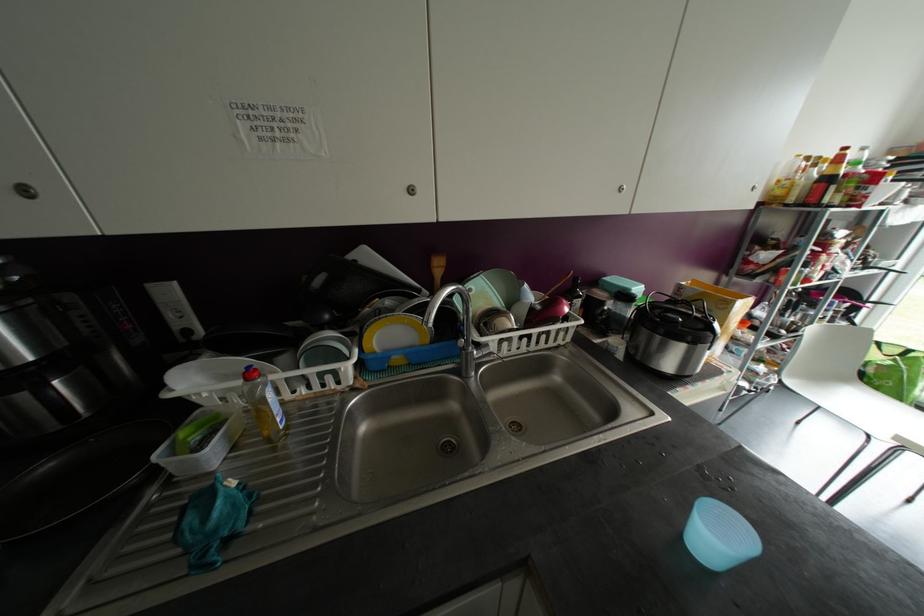
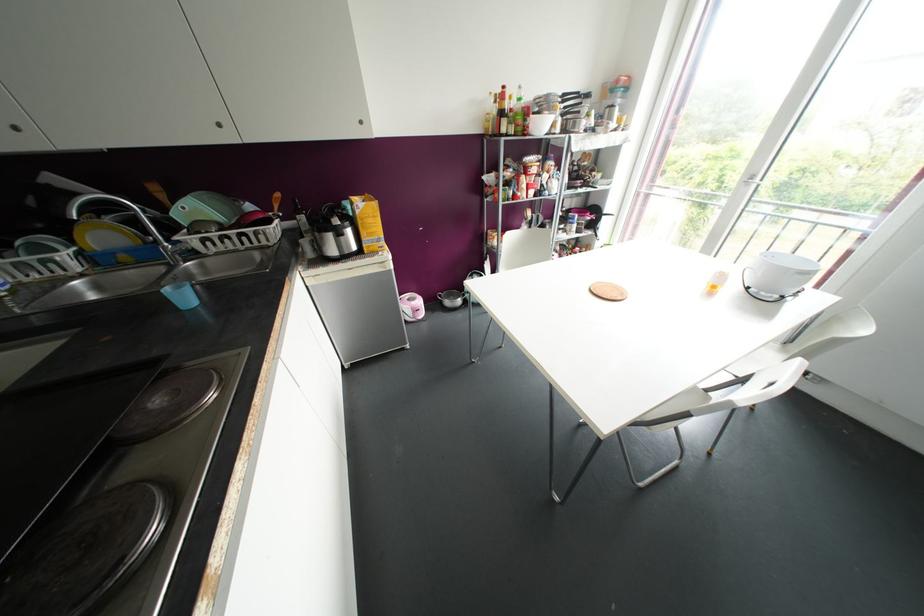
Locate, in the second image, the point that corresponds to point 619,188 in the first image.

(219, 124)